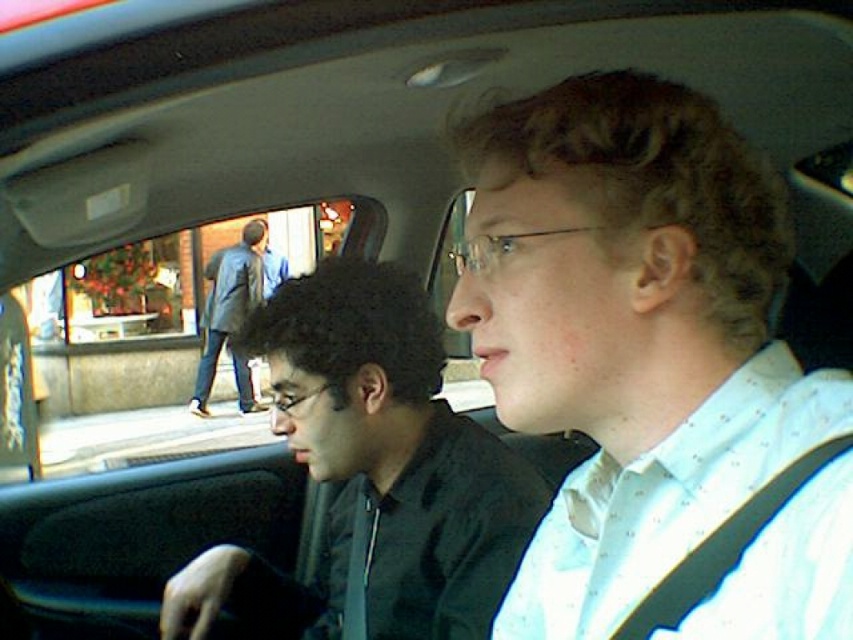
You are a fashion designer observing the car interior. You notice the black matte shirt at center and the dark gray coat at center. Which clothing item is smaller in size?

The black matte shirt at center has a smaller size compared to the dark gray coat at center.

In the scene shown: You are sitting in the passenger seat of the car and notice the white dotted shirt at center. Can you determine if the shirt is closer to the dashboard or the rearview mirror based on its position?

The white dotted shirt at center is located at point (x=653, y=369), which places it closer to the dashboard than the rearview mirror.

What are the coordinates of the black matte shirt at center?

The black matte shirt at center is located at coordinates point (372, 472).